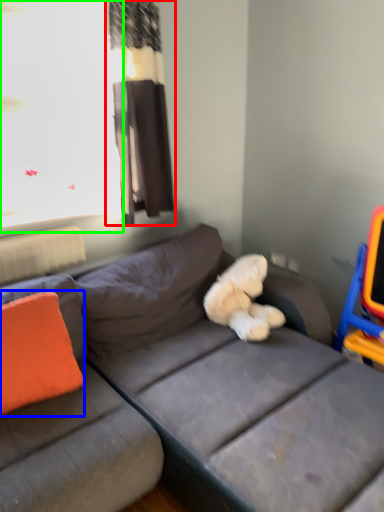
Question: Which is farther away from curtain (highlighted by a red box)? throw pillow (highlighted by a blue box) or window screen (highlighted by a green box)?

Choices:
 (A) throw pillow
 (B) window screen

Answer: (A)